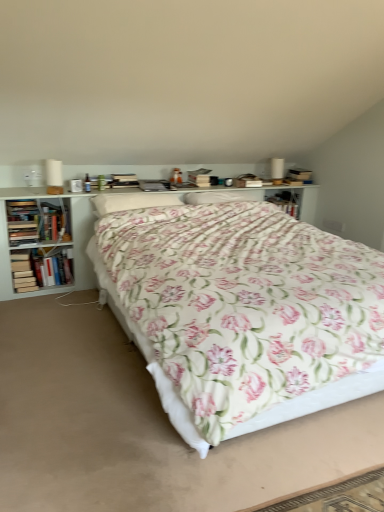
Question: Can we say hardcover book at left, the second book viewed from the top, lies outside hardcover book at left, the first book in the bottom-to-top sequence?

Choices:
 (A) yes
 (B) no

Answer: (A)

Question: Is hardcover book at left, the second book viewed from the top, beside hardcover book at left, which is counted as the 3th book, starting from the top?

Choices:
 (A) no
 (B) yes

Answer: (A)

Question: Is hardcover book at left, the second book viewed from the top, at the left side of hardcover book at left, the first book in the bottom-to-top sequence?

Choices:
 (A) yes
 (B) no

Answer: (B)

Question: From a real-world perspective, is hardcover book at left, the second book when ordered from bottom to top, located beneath hardcover book at left, which is counted as the 3th book, starting from the top?

Choices:
 (A) yes
 (B) no

Answer: (A)

Question: Does hardcover book at left, the second book when ordered from bottom to top, have a smaller size compared to hardcover book at left, which is counted as the 3th book, starting from the top?

Choices:
 (A) no
 (B) yes

Answer: (A)

Question: Is white soft pillow at center in front of or behind floral fabric bed at center in the image?

Choices:
 (A) behind
 (B) front

Answer: (A)

Question: Is white soft pillow at center inside or outside of floral fabric bed at center?

Choices:
 (A) inside
 (B) outside

Answer: (A)

Question: Looking at their shapes, would you say white soft pillow at center is wider or thinner than floral fabric bed at center?

Choices:
 (A) wide
 (B) thin

Answer: (B)

Question: Is point (144, 201) closer or farther from the camera than point (210, 359)?

Choices:
 (A) farther
 (B) closer

Answer: (A)

Question: Is hardcover book at left, which is counted as the 3th book, starting from the top, wider or thinner than white wood bookcase at center?

Choices:
 (A) thin
 (B) wide

Answer: (A)

Question: From the image's perspective, is hardcover book at left, which is counted as the 3th book, starting from the top, positioned above or below white wood bookcase at center?

Choices:
 (A) above
 (B) below

Answer: (B)

Question: Is hardcover book at left, the first book in the bottom-to-top sequence, inside or outside of white wood bookcase at center?

Choices:
 (A) inside
 (B) outside

Answer: (A)

Question: Relative to white wood bookcase at center, is hardcover book at left, which is counted as the 3th book, starting from the top, in front or behind?

Choices:
 (A) front
 (B) behind

Answer: (B)

Question: Considering the positions of white soft pillow at center and hardcover book at left, the second book viewed from the top, in the image, is white soft pillow at center taller or shorter than hardcover book at left, the second book viewed from the top,?

Choices:
 (A) tall
 (B) short

Answer: (B)

Question: From a real-world perspective, is white soft pillow at center physically located above or below hardcover book at left, the second book viewed from the top?

Choices:
 (A) above
 (B) below

Answer: (A)